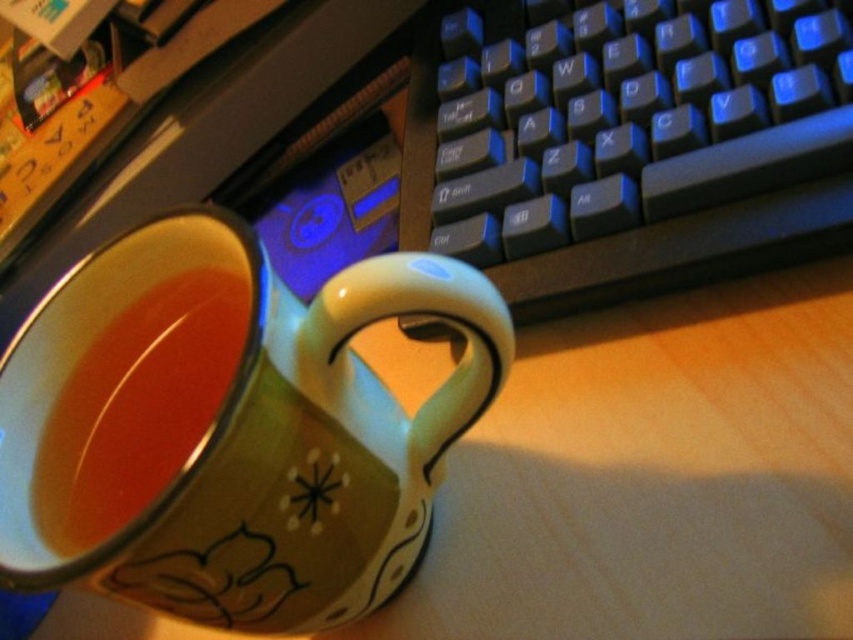
Consider the image. You are organizing items on your desk and need to place the matte ceramic mug at center and the black plastic keyboard at upper right. Given their sizes, which object should you prioritize placing first to ensure they both fit on the desk?

The matte ceramic mug at center is smaller than the black plastic keyboard at upper right, so you should prioritize placing the larger black plastic keyboard at upper right first to ensure there is enough space for both items.

You are looking at the ceramic mug on the desk. There are two points marked on the mug. Which point is closer to you, point (x=258, y=312) or point (x=223, y=355)?

Point (x=258, y=312) is closer to the viewer than point (x=223, y=355).

You are organizing items on a desk and need to place a new item between the matte ceramic mug at center and the black plastic keyboard at upper right. Based on their widths, which item should be placed closer to the edge of the desk to ensure there is enough space?

The matte ceramic mug at center has a lesser width compared to the black plastic keyboard at upper right, so the wider black plastic keyboard at upper right should be placed closer to the edge of the desk to accommodate its larger size, leaving space for the narrower mug in the center.